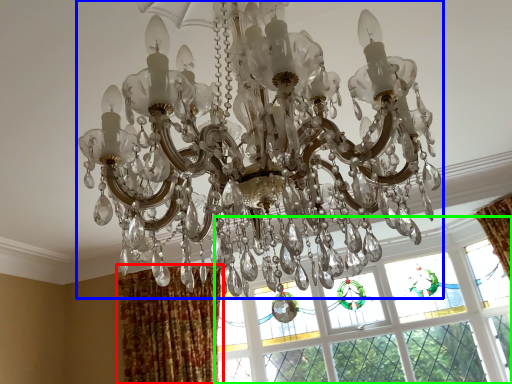
Question: Based on their relative distances, which object is farther from curtain (highlighted by a red box)? Choose from lamp (highlighted by a blue box) and window (highlighted by a green box).

Choices:
 (A) lamp
 (B) window

Answer: (A)